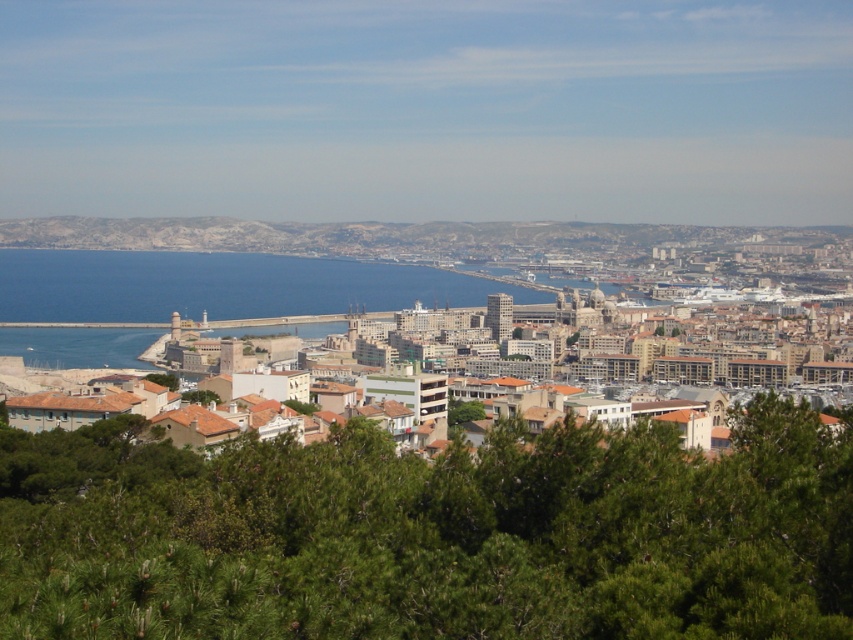
Can you confirm if green leafy tree at lower center is taller than green leafy tree at center?

Yes.

Where is `green leafy tree at lower center`? This screenshot has width=853, height=640. green leafy tree at lower center is located at coordinates (430, 536).

Where is `green leafy tree at lower center`? This screenshot has width=853, height=640. green leafy tree at lower center is located at coordinates click(x=430, y=536).

Is point (91, 618) positioned behind point (366, 292)?

No, (91, 618) is in front of (366, 292).

At what (x,y) coordinates should I click in order to perform the action: click on green leafy tree at lower center. Please return your answer as a coordinate pair (x, y). Looking at the image, I should click on (430, 536).

Can you confirm if blue water at center is taller than green leafy tree at center?

Indeed, blue water at center has a greater height compared to green leafy tree at center.

Can you confirm if blue water at center is positioned to the right of green leafy tree at center?

No, blue water at center is not to the right of green leafy tree at center.

The image size is (853, 640). What are the coordinates of `blue water at center` in the screenshot? It's located at (219, 285).

You are a GUI agent. You are given a task and a screenshot of the screen. Output one action in this format:
    pyautogui.click(x=<x>, y=<y>)
    Task: Click on the blue water at center
    The height and width of the screenshot is (640, 853).
    Given the screenshot: What is the action you would take?
    pyautogui.click(x=219, y=285)